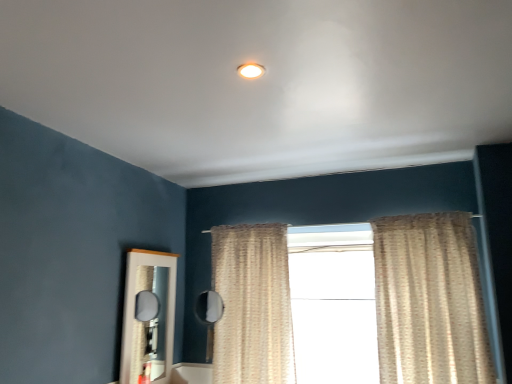
What do you see at coordinates (147, 318) in the screenshot?
I see `white glossy mirror at lower left` at bounding box center [147, 318].

Locate an element on the screen. This screenshot has width=512, height=384. matte white light fixture at upper center is located at coordinates (251, 70).

The width and height of the screenshot is (512, 384). What do you see at coordinates (334, 306) in the screenshot? I see `white sheer curtains at center` at bounding box center [334, 306].

The image size is (512, 384). I want to click on beige textured curtain at center, arranged as the first curtain when viewed from the left, so click(x=252, y=305).

The image size is (512, 384). Identify the location of matte blue wall at left. (73, 252).

You are a GUI agent. You are given a task and a screenshot of the screen. Output one action in this format:
    pyautogui.click(x=<x>, y=<y>)
    Task: Click on the beige textured curtain at right, which is the 1th curtain from right to left
    The image size is (512, 384).
    Given the screenshot: What is the action you would take?
    pyautogui.click(x=429, y=301)

Image resolution: width=512 pixels, height=384 pixels. Find the location of `white glossy mirror at lower left`. white glossy mirror at lower left is located at coordinates (147, 318).

From the image's perspective, is matte white light fixture at upper center beneath beige textured curtain at center, arranged as the first curtain when viewed from the left?

No, from the image's perspective, matte white light fixture at upper center is not beneath beige textured curtain at center, arranged as the first curtain when viewed from the left.

From a real-world perspective, is matte white light fixture at upper center physically located above or below beige textured curtain at center, arranged as the first curtain when viewed from the left?

In terms of real-world spatial position, matte white light fixture at upper center is above beige textured curtain at center, arranged as the first curtain when viewed from the left.

Is matte white light fixture at upper center in contact with beige textured curtain at center, arranged as the first curtain when viewed from the left?

No, matte white light fixture at upper center is not making contact with beige textured curtain at center, arranged as the first curtain when viewed from the left.

Based on their sizes in the image, would you say matte white light fixture at upper center is bigger or smaller than beige textured curtain at center, arranged as the first curtain when viewed from the left?

Considering their sizes, matte white light fixture at upper center takes up less space than beige textured curtain at center, arranged as the first curtain when viewed from the left.

Between beige textured curtain at center, arranged as the first curtain when viewed from the left, and white glossy mirror at lower left, which one is positioned behind?

beige textured curtain at center, arranged as the first curtain when viewed from the left, is further from the camera.

From a real-world perspective, is beige textured curtain at center, arranged as the first curtain when viewed from the left, under white glossy mirror at lower left?

Incorrect, from a real-world perspective, beige textured curtain at center, arranged as the first curtain when viewed from the left, is higher than white glossy mirror at lower left.

How different are the orientations of beige textured curtain at center, which appears as the 2th curtain when viewed from the right, and white glossy mirror at lower left in degrees?

90.8 degrees.

Between white sheer curtains at center and beige textured curtain at right, which is the 1th curtain from right to left, which one has larger size?

With larger size is beige textured curtain at right, which is the 1th curtain from right to left.

How far apart are white sheer curtains at center and beige textured curtain at right, which is the 1th curtain from right to left?

The distance of white sheer curtains at center from beige textured curtain at right, which is the 1th curtain from right to left, is 15.90 inches.

How many degrees apart are the facing directions of white sheer curtains at center and beige textured curtain at right, positioned as the 2th curtain in left-to-right order?

They differ by 3.35 degrees in their facing directions.

From the image's perspective, between white sheer curtains at center and beige textured curtain at right, which is the 1th curtain from right to left, who is located below?

white sheer curtains at center.

Is white glossy mirror at lower left placed right next to matte white light fixture at upper center?

No, white glossy mirror at lower left is not beside matte white light fixture at upper center.

From a real-world perspective, between white glossy mirror at lower left and matte white light fixture at upper center, who is vertically higher?

In real-world perspective, matte white light fixture at upper center is above.

Does white glossy mirror at lower left turn towards matte white light fixture at upper center?

No.

How different are the orientations of white glossy mirror at lower left and matte white light fixture at upper center in degrees?

There is a 90.9-degree angle between the facing directions of white glossy mirror at lower left and matte white light fixture at upper center.

The width and height of the screenshot is (512, 384). Identify the location of screen door on the right of matte blue wall at left. (147, 318).

How many degrees apart are the facing directions of matte blue wall at left and white glossy mirror at lower left?

There is a 0.0254-degree angle between the facing directions of matte blue wall at left and white glossy mirror at lower left.

Does matte blue wall at left come behind white glossy mirror at lower left?

No.

Considering the positions of objects matte blue wall at left and white glossy mirror at lower left in the image provided, who is more to the right, matte blue wall at left or white glossy mirror at lower left?

white glossy mirror at lower left.

Which of these two, beige textured curtain at right, which is the 1th curtain from right to left, or matte white light fixture at upper center, is thinner?

Thinner between the two is matte white light fixture at upper center.

From the picture: In the image, is beige textured curtain at right, positioned as the 2th curtain in left-to-right order, on the left side or the right side of matte white light fixture at upper center?

beige textured curtain at right, positioned as the 2th curtain in left-to-right order, is to the right of matte white light fixture at upper center.

From a real-world perspective, which is physically above, beige textured curtain at right, which is the 1th curtain from right to left, or matte white light fixture at upper center?

matte white light fixture at upper center, from a real-world perspective.

Does point (396, 372) come farther from viewer compared to point (248, 76)?

Yes, point (396, 372) is behind point (248, 76).

Which of these two, matte white light fixture at upper center or white glossy mirror at lower left, is bigger?

With larger size is white glossy mirror at lower left.

From a real-world perspective, is matte white light fixture at upper center located beneath white glossy mirror at lower left?

No.

Where is `lighting on the right side of white glossy mirror at lower left`? The image size is (512, 384). lighting on the right side of white glossy mirror at lower left is located at coordinates (251, 70).

Identify the location of lighting that is in front of the beige textured curtain at center, which appears as the 2th curtain when viewed from the right. (251, 70).

At what (x,y) coordinates should I click in order to perform the action: click on the 1st curtain counting from the right side of the white glossy mirror at lower left. Please return your answer as a coordinate pair (x, y). Image resolution: width=512 pixels, height=384 pixels. Looking at the image, I should click on (252, 305).

Based on the photo, based on their spatial positions, is white sheer curtains at center or matte blue wall at left closer to beige textured curtain at center, which appears as the 2th curtain when viewed from the right?

The object closer to beige textured curtain at center, which appears as the 2th curtain when viewed from the right, is white sheer curtains at center.

From the image, which object appears to be nearer to beige textured curtain at center, arranged as the first curtain when viewed from the left, white glossy mirror at lower left or beige textured curtain at right, which is the 1th curtain from right to left?

Among the two, white glossy mirror at lower left is located nearer to beige textured curtain at center, arranged as the first curtain when viewed from the left.

Looking at the image, which one is located closer to beige textured curtain at center, arranged as the first curtain when viewed from the left, beige textured curtain at right, which is the 1th curtain from right to left, or white sheer curtains at center?

white sheer curtains at center.

Considering their positions, is matte white light fixture at upper center positioned closer to white sheer curtains at center than beige textured curtain at right, which is the 1th curtain from right to left?

beige textured curtain at right, which is the 1th curtain from right to left, lies closer to white sheer curtains at center than the other object.

Considering their positions, is beige textured curtain at right, positioned as the 2th curtain in left-to-right order, positioned closer to matte white light fixture at upper center than beige textured curtain at center, which appears as the 2th curtain when viewed from the right?

beige textured curtain at right, positioned as the 2th curtain in left-to-right order, is positioned closer to the anchor matte white light fixture at upper center.

Considering their positions, is beige textured curtain at center, which appears as the 2th curtain when viewed from the right, positioned further to matte white light fixture at upper center than matte blue wall at left?

Among the two, beige textured curtain at center, which appears as the 2th curtain when viewed from the right, is located further to matte white light fixture at upper center.

From the image, which object appears to be nearer to beige textured curtain at center, which appears as the 2th curtain when viewed from the right, white glossy mirror at lower left or matte blue wall at left?

Among the two, white glossy mirror at lower left is located nearer to beige textured curtain at center, which appears as the 2th curtain when viewed from the right.

Looking at the image, which one is located closer to white sheer curtains at center, matte blue wall at left or beige textured curtain at right, which is the 1th curtain from right to left?

Among the two, beige textured curtain at right, which is the 1th curtain from right to left, is located nearer to white sheer curtains at center.

Where is `window situated between white glossy mirror at lower left and beige textured curtain at right, positioned as the 2th curtain in left-to-right order, from left to right`? The image size is (512, 384). window situated between white glossy mirror at lower left and beige textured curtain at right, positioned as the 2th curtain in left-to-right order, from left to right is located at coordinates (334, 306).

Locate an element on the screen. backdrop between matte white light fixture at upper center and white glossy mirror at lower left from top to bottom is located at coordinates tap(73, 252).

The width and height of the screenshot is (512, 384). I want to click on screen door positioned between matte blue wall at left and beige textured curtain at center, which appears as the 2th curtain when viewed from the right, from near to far, so click(x=147, y=318).

At what (x,y) coordinates should I click in order to perform the action: click on curtain between matte blue wall at left and white sheer curtains at center from left to right. Please return your answer as a coordinate pair (x, y). Image resolution: width=512 pixels, height=384 pixels. Looking at the image, I should click on (252, 305).